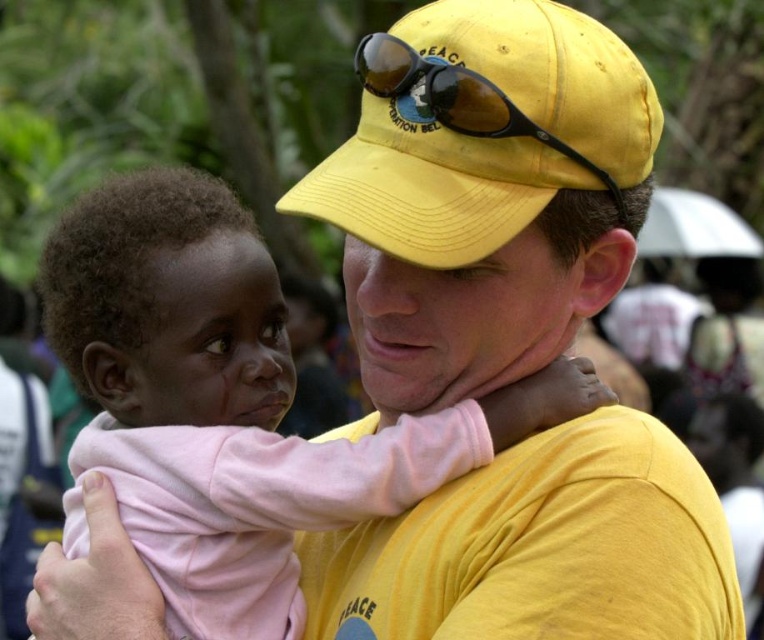
Question: Can you confirm if pink fleece baby at center is wider than yellow matte sunglasses at center?

Choices:
 (A) yes
 (B) no

Answer: (A)

Question: Which of the following is the farthest from the observer?

Choices:
 (A) (484, 131)
 (B) (261, 365)

Answer: (B)

Question: Does pink fleece baby at center appear on the right side of yellow matte sunglasses at center?

Choices:
 (A) no
 (B) yes

Answer: (A)

Question: Does pink fleece baby at center appear over yellow matte sunglasses at center?

Choices:
 (A) yes
 (B) no

Answer: (B)

Question: Which point is farther to the camera?

Choices:
 (A) yellow matte sunglasses at center
 (B) pink fleece baby at center

Answer: (B)